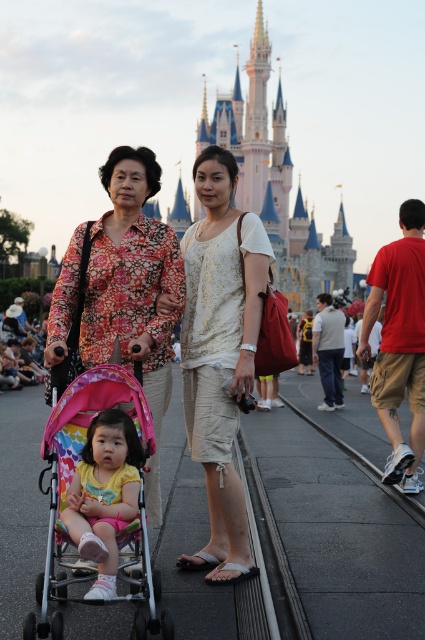
You are a photographer standing at the entrance of the theme park and want to take a photo of the white cotton dress at center and the pastel pink fabric stroller at center. Which object should you focus on first if you want to capture both in the frame without moving the camera?

The white cotton dress at center is much taller than the pastel pink fabric stroller at center, so you should focus on the white cotton dress at center first to ensure it is fully in frame before adjusting for the stroller.

You are a photographer at the theme park. You want to take a photo of the floral fabric dress at center and the multicolored fabric baby carriage at center. Which object should be placed closer to the camera to ensure both are in focus?

The floral fabric dress at center is taller than the multicolored fabric baby carriage at center, so you should place the multicolored fabric baby carriage at center closer to the camera to ensure both are in focus.

You are a photographer at the theme park and want to capture a photo of the floral fabric dress at center and the multicolored fabric baby carriage at center. Which object is located to the right of the other?

The floral fabric dress at center is positioned on the right side of multicolored fabric baby carriage at center.